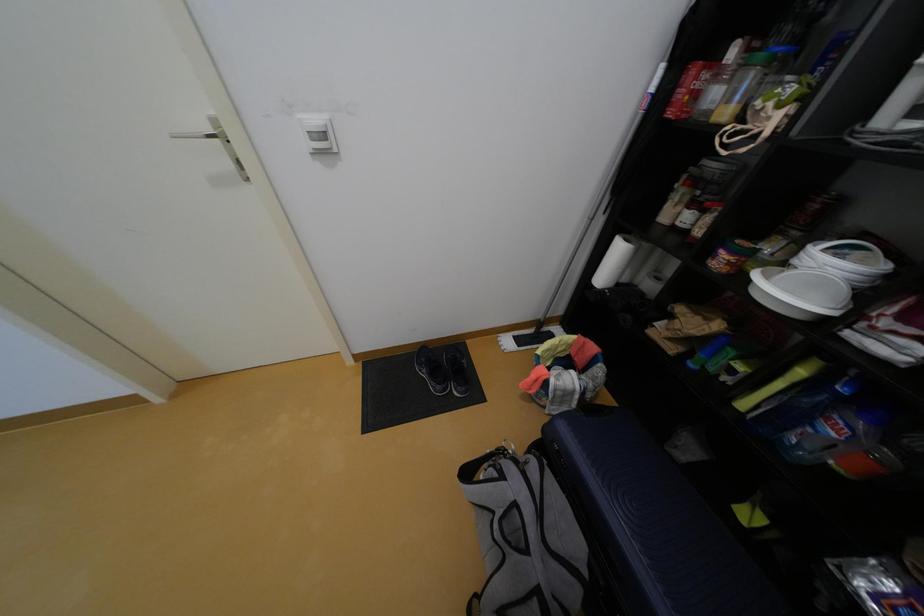
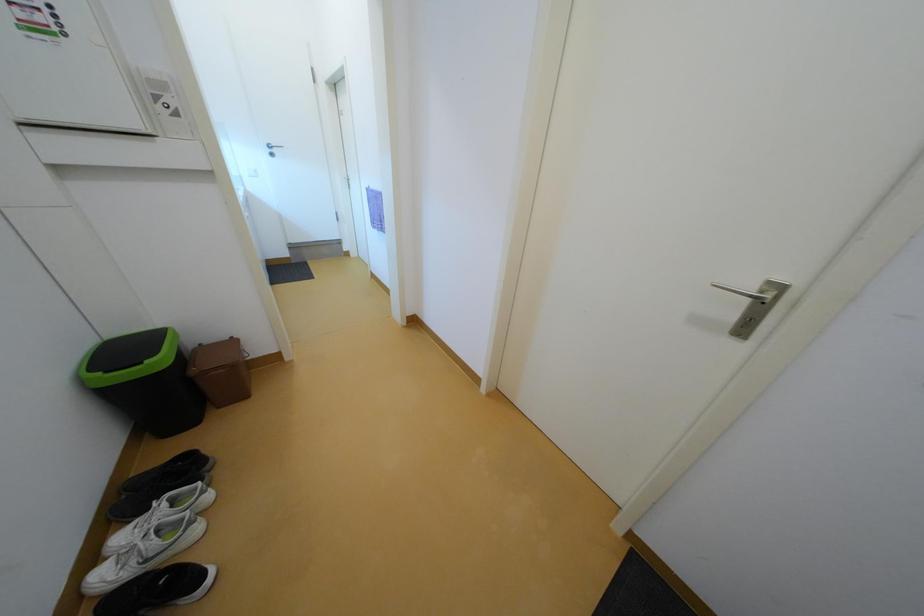
Question: The camera is either moving clockwise (left) or counter-clockwise (right) around the object. The first image is from the beginning of the video and the second image is from the end. Is the camera moving left or right when shooting the video?

Choices:
 (A) Left
 (B) Right

Answer: (B)